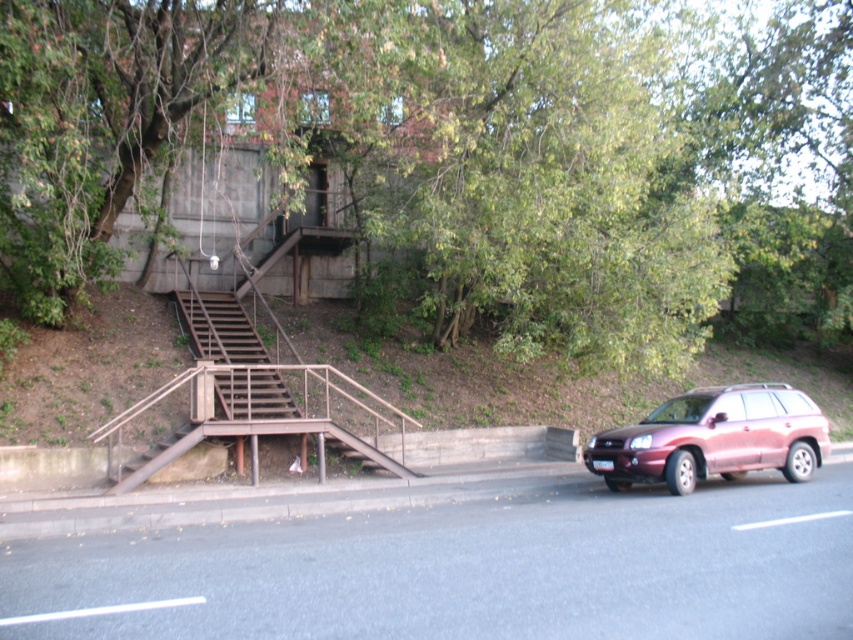
Question: From the image, what is the correct spatial relationship of metallic pink suv at right in relation to brown wooden stairs at left?

Choices:
 (A) above
 (B) below

Answer: (B)

Question: Which of the following is the closest to the observer?

Choices:
 (A) (627, 472)
 (B) (184, 289)

Answer: (A)

Question: Is green leafy tree at upper center wider than brown wooden stairs at left?

Choices:
 (A) yes
 (B) no

Answer: (A)

Question: Does metallic pink suv at right appear under brown wooden stairs at left?

Choices:
 (A) no
 (B) yes

Answer: (B)

Question: Which point is farther to the camera?

Choices:
 (A) metallic pink suv at right
 (B) green leafy tree at upper center
 (C) brown wooden stairs at left

Answer: (C)

Question: Among these points, which one is nearest to the camera?

Choices:
 (A) (819, 416)
 (B) (233, 337)

Answer: (A)